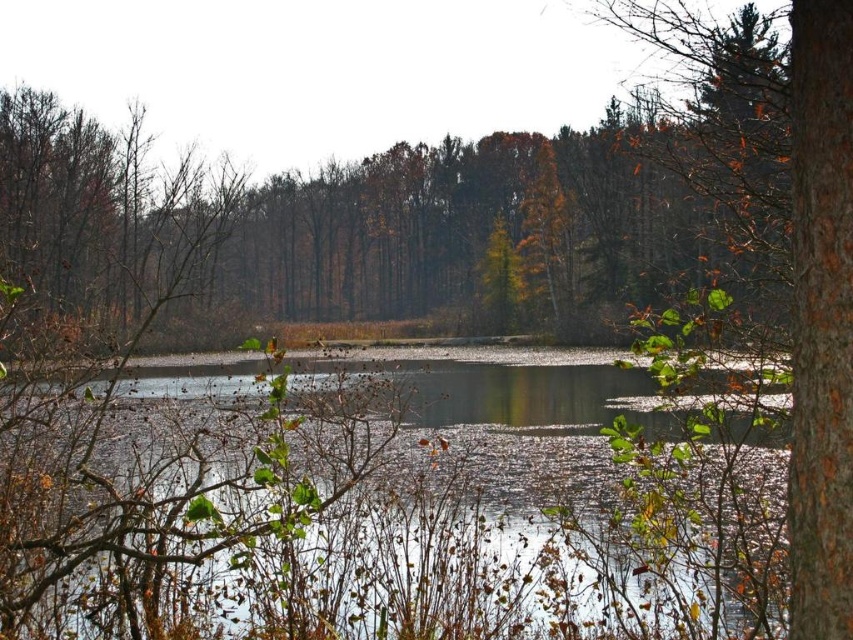
You are a hiker who wants to cross the clear water at center to reach the brown rough bark tree at right. The water is 1.2 meters deep. Can you safely cross the water if you are 1.7 meters tall?

The clear water at center is 1.2 meters deep, which is shallower than your height of 1.7 meters. Therefore, you can safely cross the clear water at center to reach the brown rough bark tree at right.

You are standing at the origin point in this serene natural scene. You see two points marked in the image. Which point is closer to you, point [538,572] or point [833,403]?

Point [833,403] is closer to you because the description states that point [538,572] is behind point [833,403].